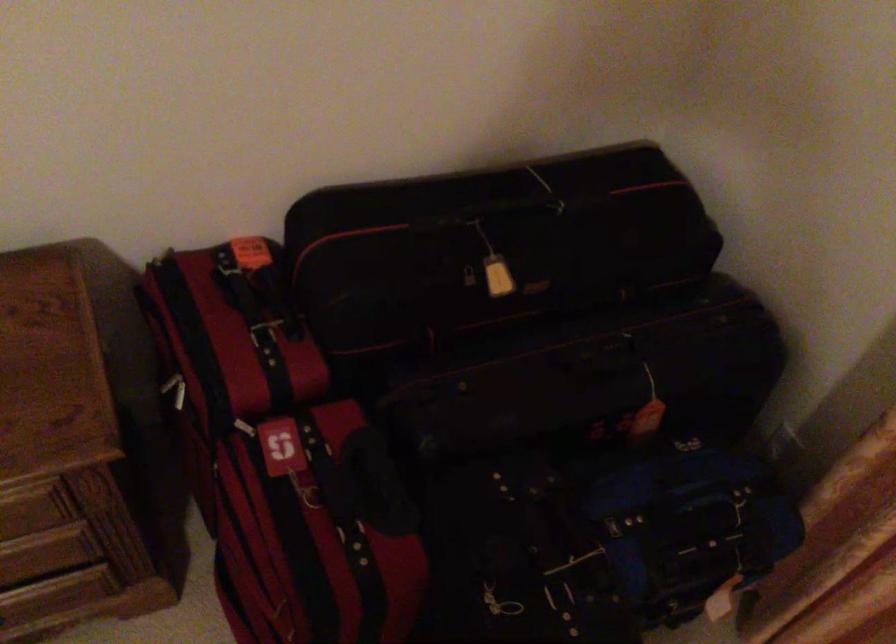
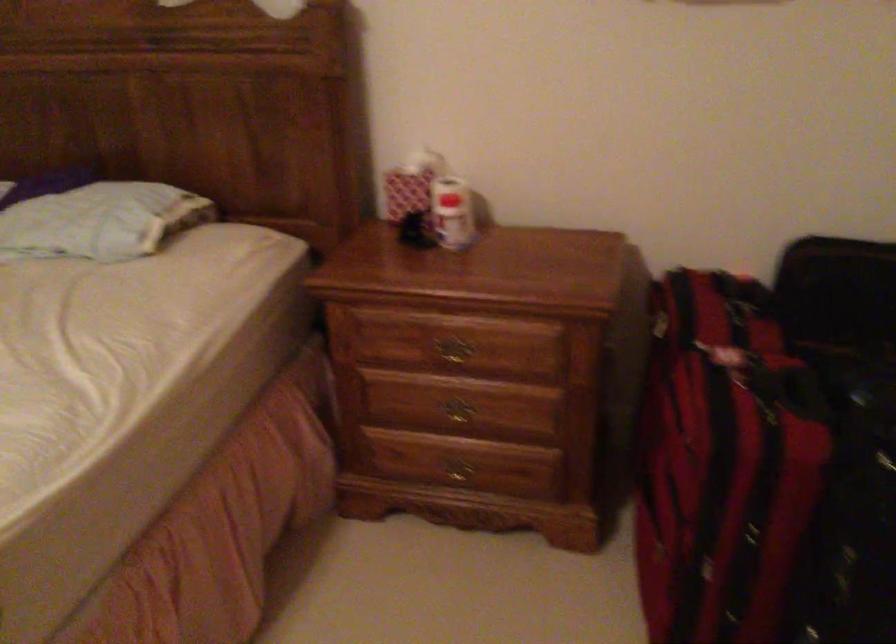
The images are taken continuously from a first-person perspective. In which direction is your viewpoint rotating?

The camera rotated toward left-up.